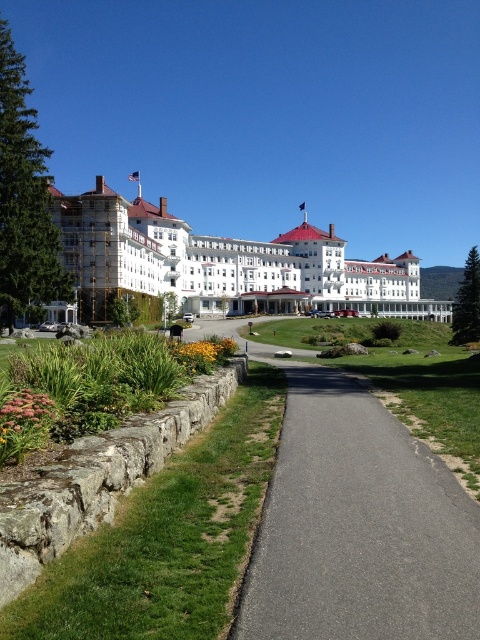
Question: Can you confirm if white/smooth hotel at center is wider than yellow matte flower at lower center?

Choices:
 (A) no
 (B) yes

Answer: (B)

Question: Does pink matte flower at lower left appear under yellow matte flower at lower center?

Choices:
 (A) yes
 (B) no

Answer: (A)

Question: Estimate the real-world distances between objects in this image. Which object is closer to the pink matte flower at lower left?

Choices:
 (A) white/smooth hotel at center
 (B) yellow matte flower at lower center

Answer: (B)

Question: Can you confirm if asphalt path at center is positioned above white/smooth hotel at center?

Choices:
 (A) yes
 (B) no

Answer: (B)

Question: Among these objects, which one is nearest to the camera?

Choices:
 (A) asphalt path at center
 (B) yellow matte flower at lower center
 (C) white/smooth hotel at center

Answer: (A)

Question: Based on their relative distances, which object is nearer to the yellow matte flower at lower center?

Choices:
 (A) white/smooth hotel at center
 (B) pink matte flower at lower left
 (C) asphalt path at center

Answer: (C)